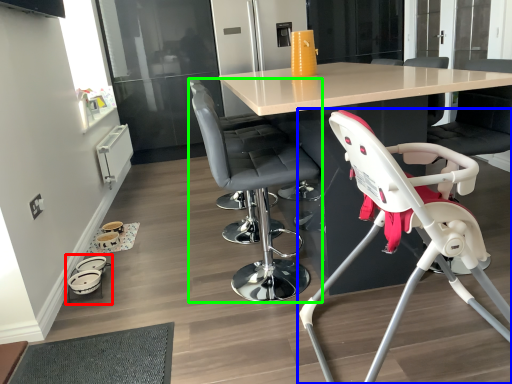
Question: Which object is positioned farthest from baby carriage (highlighted by a red box)? Select from chair (highlighted by a blue box) and chair (highlighted by a green box).

Choices:
 (A) chair
 (B) chair

Answer: (A)